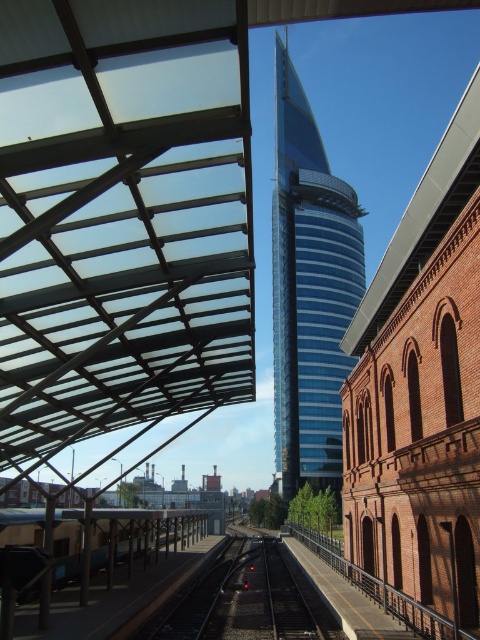
Is blue glass tower at center taller than metallic gray train at lower left?

Correct, blue glass tower at center is much taller as metallic gray train at lower left.

Can you confirm if blue glass tower at center is bigger than metallic gray train at lower left?

Yes.

Image resolution: width=480 pixels, height=640 pixels. Identify the location of blue glass tower at center. (310, 291).

Find the location of a particular element. blue glass tower at center is located at coordinates (310, 291).

The height and width of the screenshot is (640, 480). Describe the element at coordinates (310, 291) in the screenshot. I see `blue glass tower at center` at that location.

At what (x,y) coordinates should I click in order to perform the action: click on blue glass tower at center. Please return your answer as a coordinate pair (x, y). Looking at the image, I should click on (310, 291).

Who is positioned more to the left, black asphalt train track at center or metallic gray train at lower left?

From the viewer's perspective, metallic gray train at lower left appears more on the left side.

Looking at this image, can you confirm if black asphalt train track at center is bigger than metallic gray train at lower left?

Incorrect, black asphalt train track at center is not larger than metallic gray train at lower left.

Between point (208, 605) and point (85, 582), which one is positioned in front?

Point (85, 582)

Where is `black asphalt train track at center`? The height and width of the screenshot is (640, 480). black asphalt train track at center is located at coordinates (244, 598).